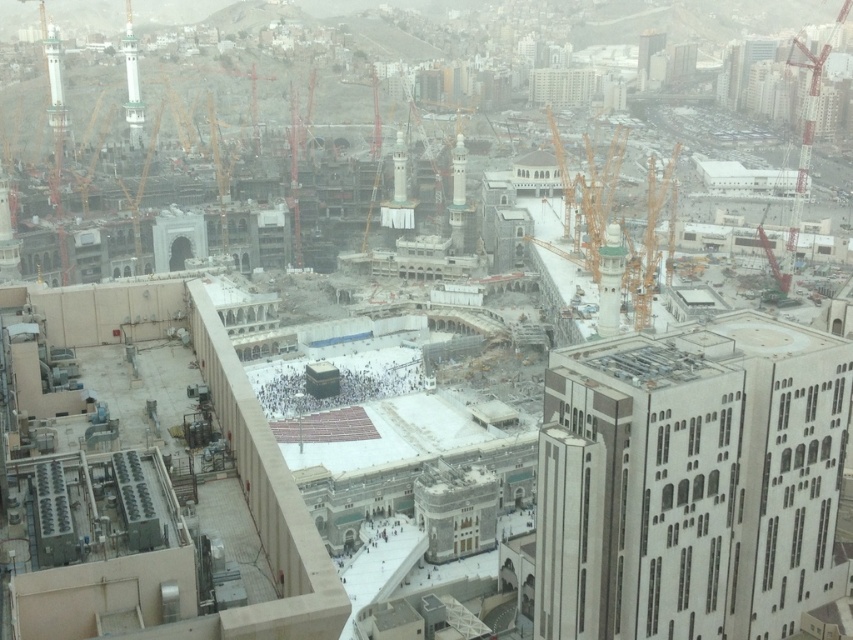
Question: From the image, what is the correct spatial relationship of metallic yellow crane at center in relation to red metal crane at right?

Choices:
 (A) right
 (B) left

Answer: (B)

Question: Among these objects, which one is farthest from the camera?

Choices:
 (A) metallic yellow crane at center
 (B) red metal crane at right

Answer: (B)

Question: Is the position of metallic yellow crane at center more distant than that of red metal crane at right?

Choices:
 (A) no
 (B) yes

Answer: (A)

Question: Which point is farther to the camera?

Choices:
 (A) (630, 259)
 (B) (814, 81)

Answer: (B)

Question: Where is metallic yellow crane at center located in relation to red metal crane at right in the image?

Choices:
 (A) below
 (B) above

Answer: (A)